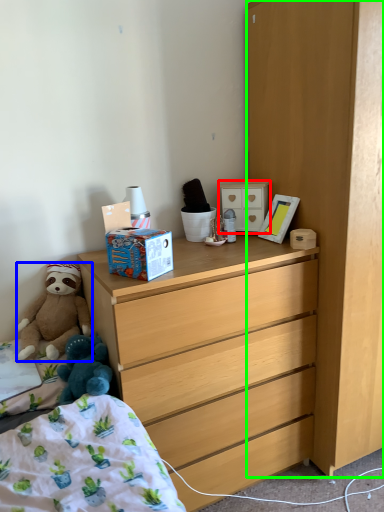
Question: Considering the real-world distances, which object is farthest from cabinetry (highlighted by a red box)? teddy bear (highlighted by a blue box) or cabinetry (highlighted by a green box)?

Choices:
 (A) teddy bear
 (B) cabinetry

Answer: (A)